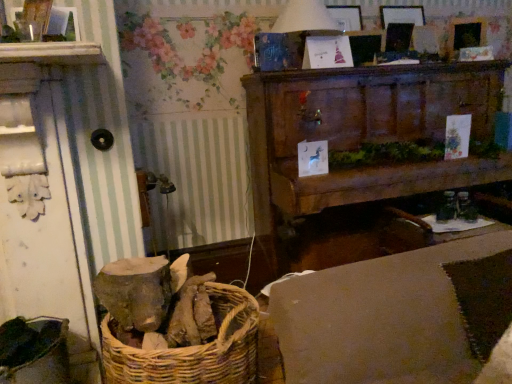
Question: Can you confirm if wooden cabinet at upper center is thinner than beige fabric couch at lower right?

Choices:
 (A) no
 (B) yes

Answer: (B)

Question: Does wooden cabinet at upper center touch beige fabric couch at lower right?

Choices:
 (A) yes
 (B) no

Answer: (B)

Question: From the image's perspective, is wooden cabinet at upper center over beige fabric couch at lower right?

Choices:
 (A) no
 (B) yes

Answer: (B)

Question: Would you say wooden cabinet at upper center is outside beige fabric couch at lower right?

Choices:
 (A) yes
 (B) no

Answer: (A)

Question: From a real-world perspective, is wooden cabinet at upper center beneath beige fabric couch at lower right?

Choices:
 (A) no
 (B) yes

Answer: (A)

Question: Is white paper lampshade at upper center inside the boundaries of wooden cabinet at upper center, or outside?

Choices:
 (A) outside
 (B) inside

Answer: (A)

Question: Considering the positions of white paper lampshade at upper center and wooden cabinet at upper center in the image, is white paper lampshade at upper center wider or thinner than wooden cabinet at upper center?

Choices:
 (A) thin
 (B) wide

Answer: (A)

Question: From a real-world perspective, is white paper lampshade at upper center positioned above or below wooden cabinet at upper center?

Choices:
 (A) below
 (B) above

Answer: (B)

Question: In terms of height, does white paper lampshade at upper center look taller or shorter compared to wooden cabinet at upper center?

Choices:
 (A) short
 (B) tall

Answer: (A)

Question: Is point (257, 139) closer or farther from the camera than point (347, 336)?

Choices:
 (A) closer
 (B) farther

Answer: (B)

Question: Would you say wooden cabinet at upper center is inside or outside beige fabric couch at lower right?

Choices:
 (A) inside
 (B) outside

Answer: (B)

Question: From the image's perspective, is wooden cabinet at upper center above or below beige fabric couch at lower right?

Choices:
 (A) below
 (B) above

Answer: (B)

Question: Is wooden cabinet at upper center bigger or smaller than beige fabric couch at lower right?

Choices:
 (A) small
 (B) big

Answer: (B)

Question: From a real-world perspective, is white paper lampshade at upper center above or below beige fabric couch at lower right?

Choices:
 (A) above
 (B) below

Answer: (A)

Question: Would you say white paper lampshade at upper center is to the left or to the right of beige fabric couch at lower right in the picture?

Choices:
 (A) left
 (B) right

Answer: (A)